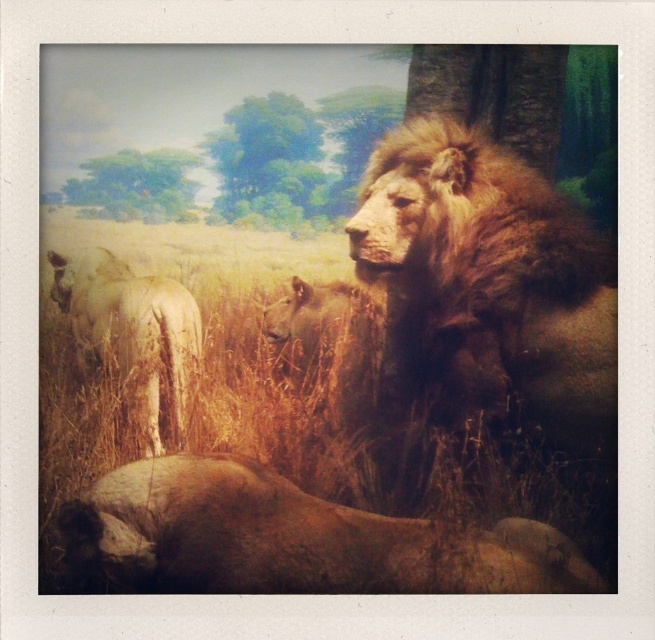
You are a safari guide observing the scene. You notice two lions in the image. Which lion, the brown furry lion at right or the brown fur lion at lower center, is bigger in size?

The brown furry lion at right is larger in size compared to the brown fur lion at lower center.

You are a wildlife photographer aiming to capture a photo of the brown furry lion at right. Your camera is set to focus at point (x=489, y=284). Will this point be effective for focusing on the brown furry lion at right?

Yes, the point (x=489, y=284) is the location of the brown furry lion at right, so focusing there will effectively capture the lion.

You are a wildlife photographer trying to capture a clear shot of the brown furry lion at right. However, the brown grass at center is blocking your view. Based on the scene description, can you determine if the grass is tall enough to obstruct the lion completely?

The brown grass at center is larger in size than the brown furry lion at right, so yes, the grass is tall enough to obstruct the lion completely.